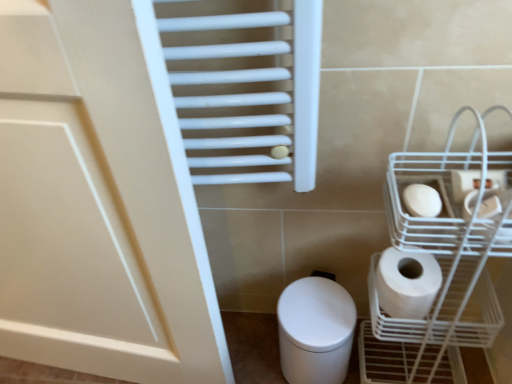
Question: Is white glossy bidet at lower center spatially inside white matte toilet paper at right, which is the 1th toilet paper in top-to-bottom order, or outside of it?

Choices:
 (A) inside
 (B) outside

Answer: (B)

Question: Would you say white glossy bidet at lower center is to the left or to the right of white matte toilet paper at right, placed as the 3th toilet paper when sorted from bottom to top, in the picture?

Choices:
 (A) left
 (B) right

Answer: (A)

Question: Estimate the real-world distances between objects in this image. Which object is farther from the white matte toilet paper at right, placed as the 3th toilet paper when sorted from bottom to top?

Choices:
 (A) white glossy bidet at lower center
 (B) white wire basket at lower right
 (C) white matte toilet paper at lower right, the first toilet paper in the bottom-to-top sequence
 (D) white matte toilet paper at right, which is counted as the second toilet paper, starting from the top

Answer: (A)

Question: Which of these objects is positioned farthest from the white matte toilet paper at lower right, the first toilet paper in the bottom-to-top sequence?

Choices:
 (A) white glossy bidet at lower center
 (B) white matte toilet paper at right, which is the 1th toilet paper in top-to-bottom order
 (C) white matte toilet paper at right, which is the 2th toilet paper from bottom to top
 (D) white wire basket at lower right

Answer: (B)